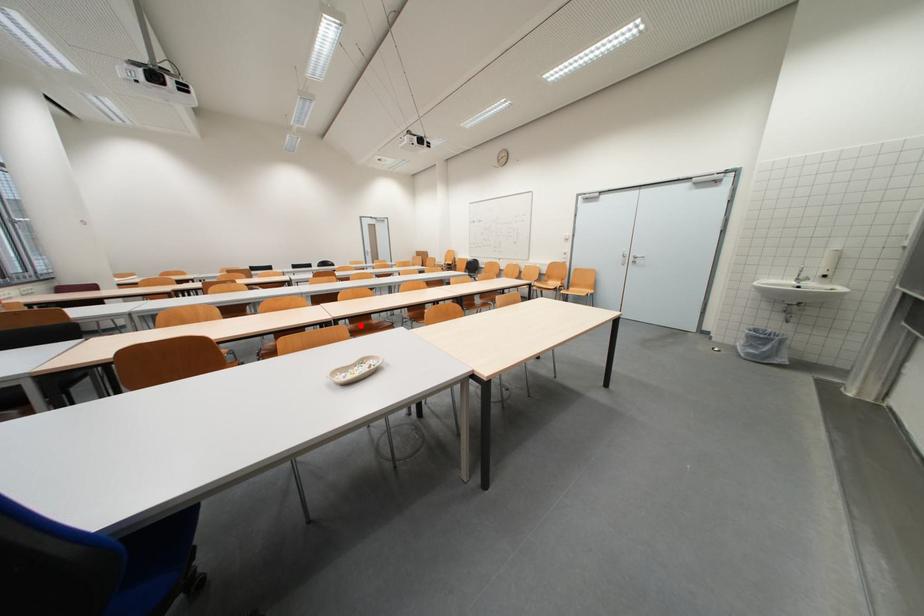
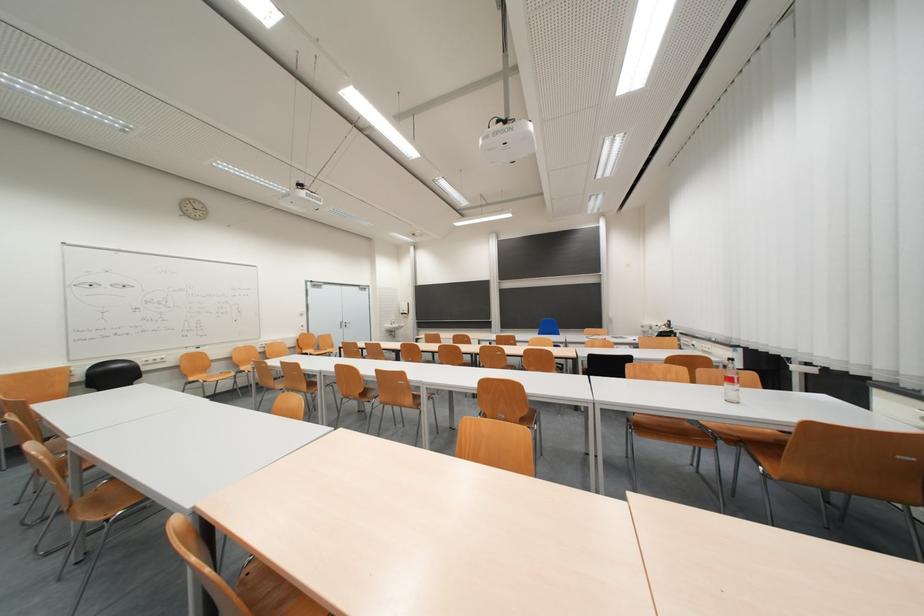
Question: I am providing you with two images of the same scene from different viewpoints. A red point is marked on the first image. At the location where the point appears in image 1, is it still visible in image 2?

Choices:
 (A) Yes
 (B) No

Answer: (B)